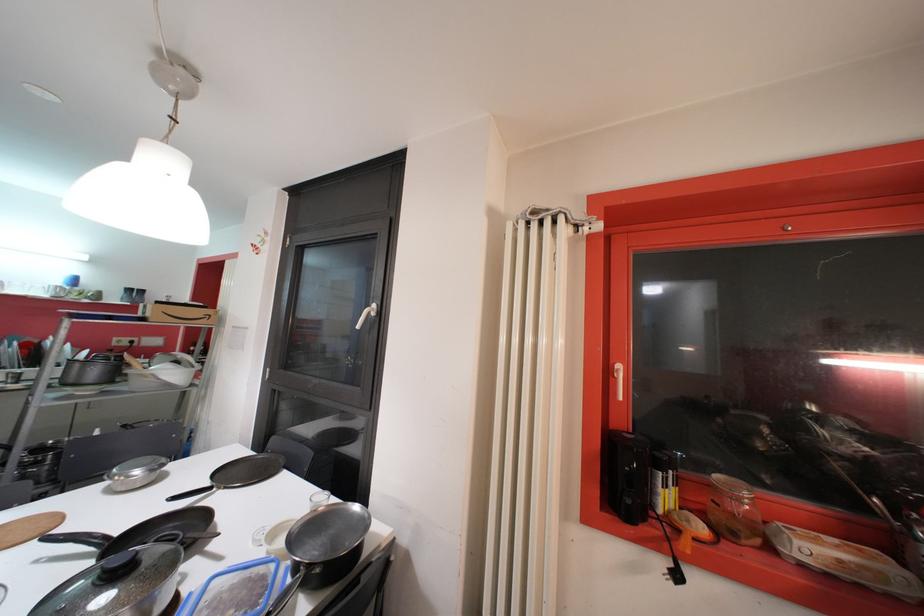
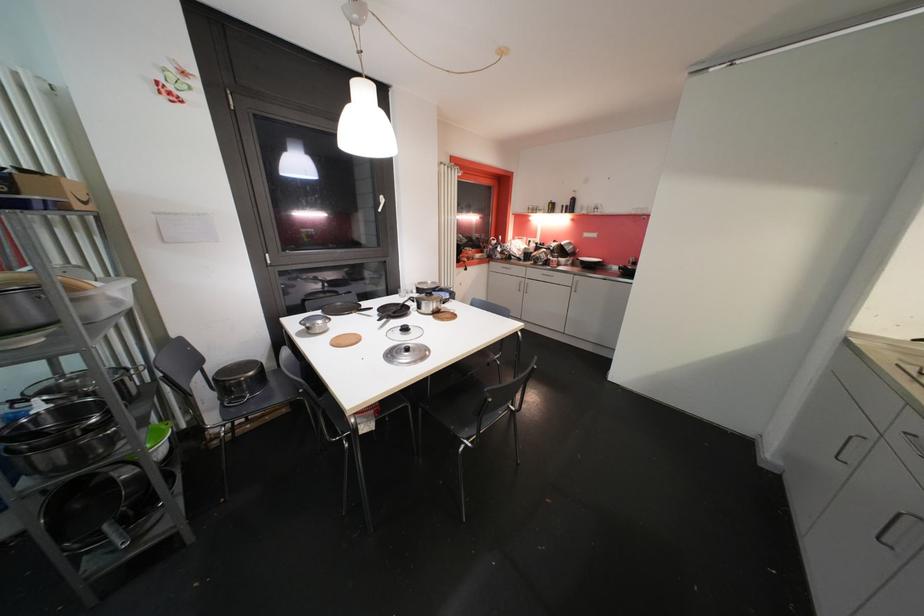
Question: I am providing you with two images of the same scene from different viewpoints. Please identify which objects are invisible in image2.

Choices:
 (A) chair sitting surface
 (B) red plastic box
 (C) small drinking glass
 (D) frying pan handle

Answer: (C)